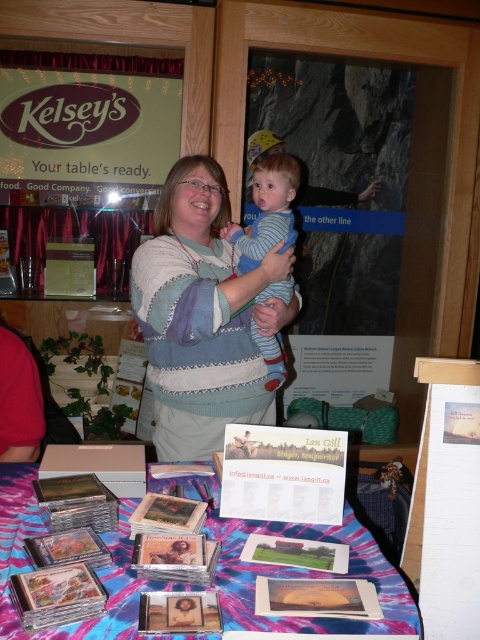
Which of these two, knitted sweater at center or striped cotton shirt at center, stands shorter?

striped cotton shirt at center is shorter.

I want to click on knitted sweater at center, so click(203, 316).

In order to click on knitted sweater at center in this screenshot , I will do `click(203, 316)`.

Who is more forward, (286, 627) or (271, 182)?

Point (286, 627) is in front.

How much distance is there between tie-dye fabric at lower center and striped cotton shirt at center?

A distance of 33.73 inches exists between tie-dye fabric at lower center and striped cotton shirt at center.

The width and height of the screenshot is (480, 640). I want to click on tie-dye fabric at lower center, so click(305, 577).

Consider the image. Is knitted sweater at center to the left of tie-dye fabric at lower center from the viewer's perspective?

No, knitted sweater at center is not to the left of tie-dye fabric at lower center.

From the picture: Can you confirm if knitted sweater at center is bigger than tie-dye fabric at lower center?

Yes.

Is point (239, 369) in front of point (241, 580)?

No, (239, 369) is further to viewer.

At what (x,y) coordinates should I click in order to perform the action: click on knitted sweater at center. Please return your answer as a coordinate pair (x, y). Looking at the image, I should click on (203, 316).